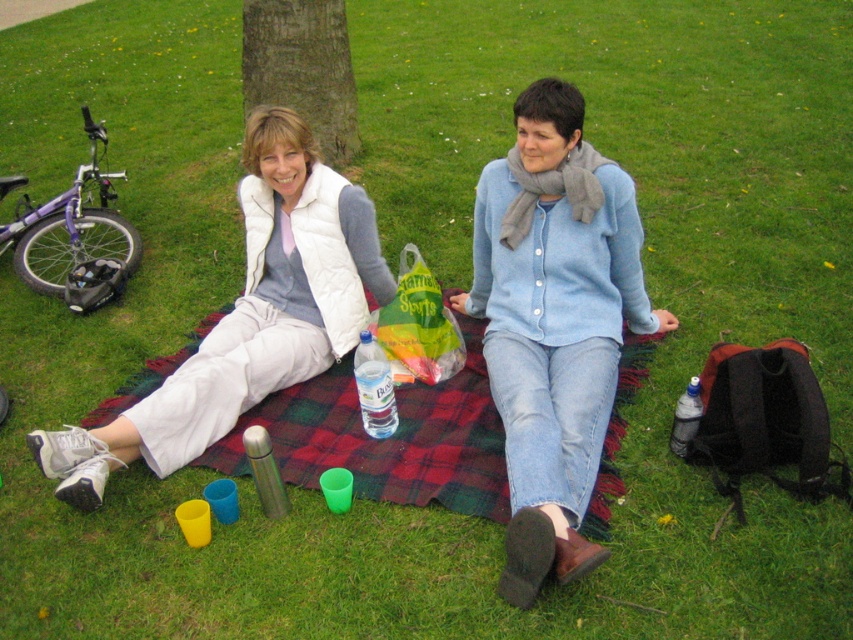
Does plaid fabric blanket at center lie behind translucent plastic bottle at lower right?

No, plaid fabric blanket at center is closer to the viewer.

This screenshot has width=853, height=640. Describe the element at coordinates (387, 438) in the screenshot. I see `plaid fabric blanket at center` at that location.

At what (x,y) coordinates should I click in order to perform the action: click on plaid fabric blanket at center. Please return your answer as a coordinate pair (x, y). This screenshot has height=640, width=853. Looking at the image, I should click on (387, 438).

Looking at this image, which of these two, white puffy vest at upper left or clear plastic bottle at center, stands shorter?

Standing shorter between the two is clear plastic bottle at center.

Which is more to the right, white puffy vest at upper left or clear plastic bottle at center?

From the viewer's perspective, clear plastic bottle at center appears more on the right side.

Is point (244, 182) positioned after point (376, 369)?

That is True.

At what (x,y) coordinates should I click in order to perform the action: click on white puffy vest at upper left. Please return your answer as a coordinate pair (x, y). Image resolution: width=853 pixels, height=640 pixels. Looking at the image, I should click on (248, 316).

Is brown textured tree at upper center to the left of translucent plastic bottle at lower right from the viewer's perspective?

Indeed, brown textured tree at upper center is positioned on the left side of translucent plastic bottle at lower right.

In the scene shown: Who is positioned more to the left, brown textured tree at upper center or translucent plastic bottle at lower right?

From the viewer's perspective, brown textured tree at upper center appears more on the left side.

Does point (339, 49) come farther from viewer compared to point (697, 419)?

Yes, it is behind point (697, 419).

Image resolution: width=853 pixels, height=640 pixels. In order to click on brown textured tree at upper center in this screenshot , I will do `click(302, 67)`.